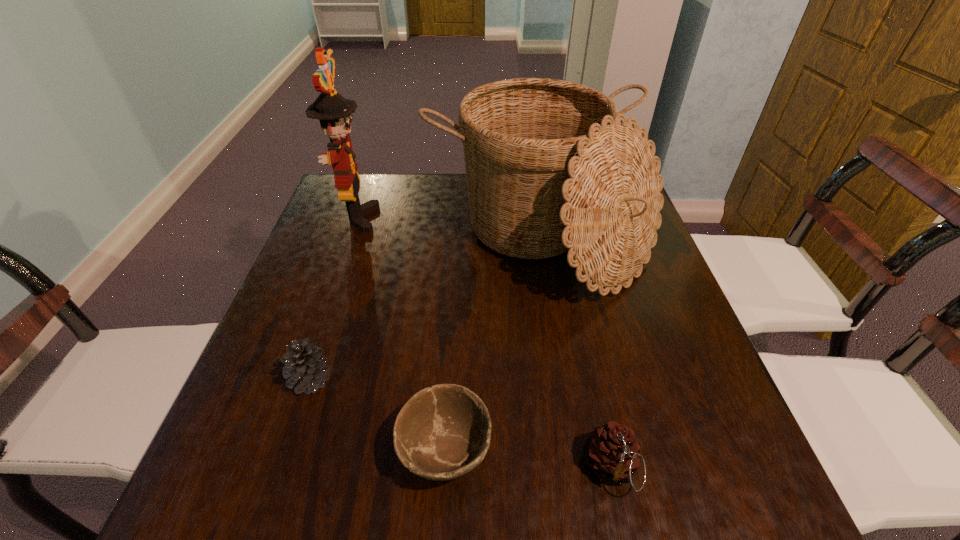
In the image, there is a desktop. Where is `vacant area at the left edge`? vacant area at the left edge is located at coordinates (309, 264).

Locate an element on the screen. The height and width of the screenshot is (540, 960). free region at the right edge of the desktop is located at coordinates (665, 367).

I want to click on vacant area between the shortest object and the tallest object, so click(401, 335).

Identify the location of vacant space in between the third nearest object and the tallest object. The image size is (960, 540). (333, 299).

I want to click on vacant area that lies between the fourth shortest object and the tallest object, so click(x=448, y=231).

At what (x,y) coordinates should I click in order to perform the action: click on free space between the fourth shortest object and the nutcracker. Please return your answer as a coordinate pair (x, y). The image size is (960, 540). Looking at the image, I should click on (448, 231).

Identify the location of free spot between the bowl and the right pinecone. (528, 460).

Identify the location of empty location between the bowl and the farther pinecone. This screenshot has width=960, height=540. (377, 415).

I want to click on free point between the third nearest object and the bowl, so click(x=377, y=415).

The image size is (960, 540). Identify the location of free area in between the bowl and the nearer pinecone. (528, 460).